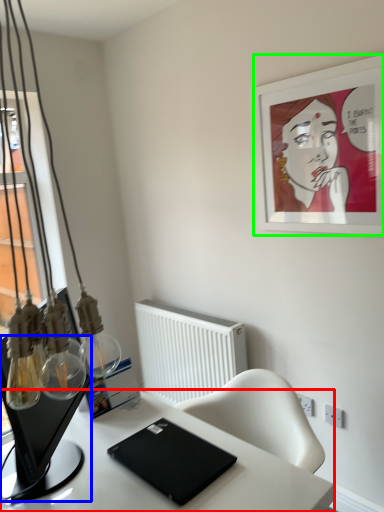
Question: Which object is positioned closest to desk (highlighted by a red box)? Select from computer monitor (highlighted by a blue box) and picture frame (highlighted by a green box).

Choices:
 (A) computer monitor
 (B) picture frame

Answer: (A)